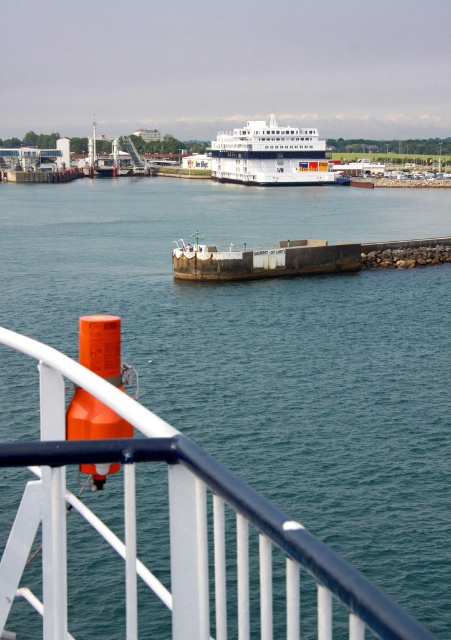
Question: Is white glossy rail at lower left positioned before white glossy cruise ship at center?

Choices:
 (A) no
 (B) yes

Answer: (B)

Question: Which of the following is the closest to the observer?

Choices:
 (A) (63, 545)
 (B) (320, 147)

Answer: (A)

Question: Which point is closer to the camera?

Choices:
 (A) (251, 502)
 (B) (262, 140)

Answer: (A)

Question: In this image, where is white glossy rail at lower left located relative to white glossy cruise ship at center?

Choices:
 (A) right
 (B) left

Answer: (B)

Question: From the image, what is the correct spatial relationship of white glossy rail at lower left in relation to white glossy cruise ship at center?

Choices:
 (A) left
 (B) right

Answer: (A)